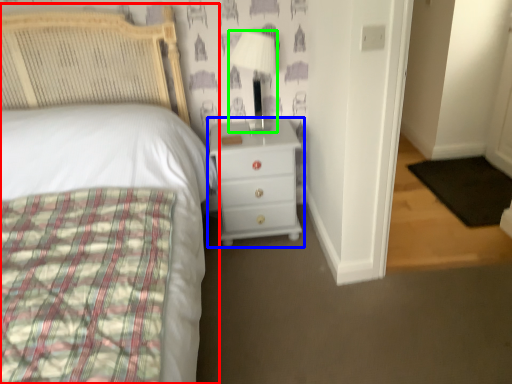
Question: Based on their relative distances, which object is farther from bed (highlighted by a red box)? Choose from chest of drawers (highlighted by a blue box) and lamp (highlighted by a green box).

Choices:
 (A) chest of drawers
 (B) lamp

Answer: (B)